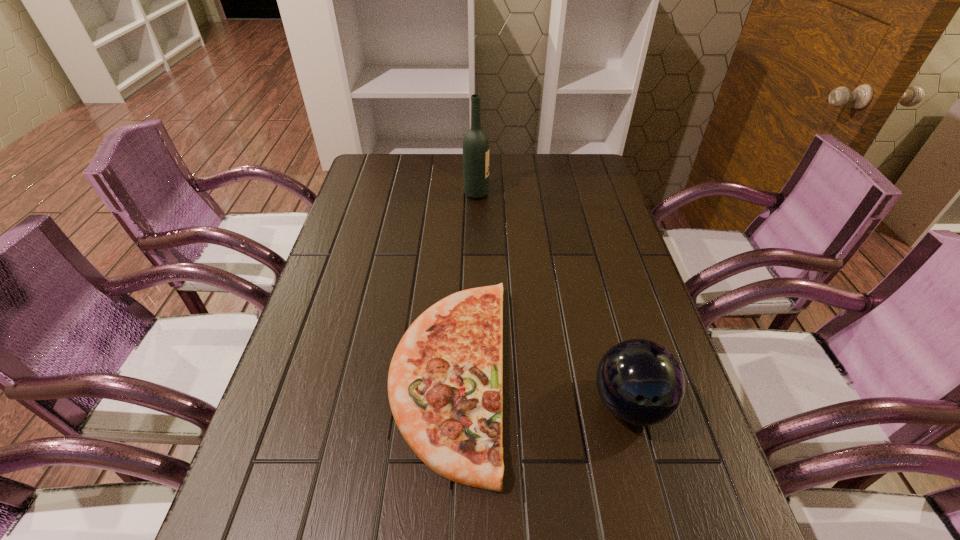
Where is `free space between the shortest object and the second shortest object`? The image size is (960, 540). free space between the shortest object and the second shortest object is located at coordinates (540, 388).

At what (x,y) coordinates should I click in order to perform the action: click on free space between the rightmost object and the shortest object. Please return your answer as a coordinate pair (x, y). The width and height of the screenshot is (960, 540). Looking at the image, I should click on (540, 388).

Image resolution: width=960 pixels, height=540 pixels. I want to click on vacant space in between the farthest object and the pizza, so click(x=463, y=283).

The width and height of the screenshot is (960, 540). I want to click on free space between the shortest object and the farthest object, so click(x=463, y=283).

Identify the location of free space between the bowling ball and the pizza. (540, 388).

I want to click on object that is the second closest to the rightmost object, so click(x=475, y=143).

Identify the location of object identified as the second closest to the tallest object. (642, 383).

The width and height of the screenshot is (960, 540). In order to click on blank area in the image that satisfies the following two spatial constraints: 1. on the labeled side of the tallest object; 2. on the front side of the shortest object in this screenshot , I will do `click(474, 373)`.

The width and height of the screenshot is (960, 540). Identify the location of blank space that satisfies the following two spatial constraints: 1. on the labeled side of the wine bottle; 2. on the front side of the shortest object. (474, 373).